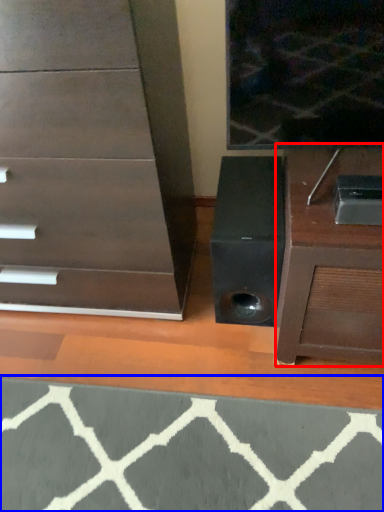
Question: Which object is closer to the camera taking this photo, furniture (highlighted by a red box) or doormat (highlighted by a blue box)?

Choices:
 (A) furniture
 (B) doormat

Answer: (B)